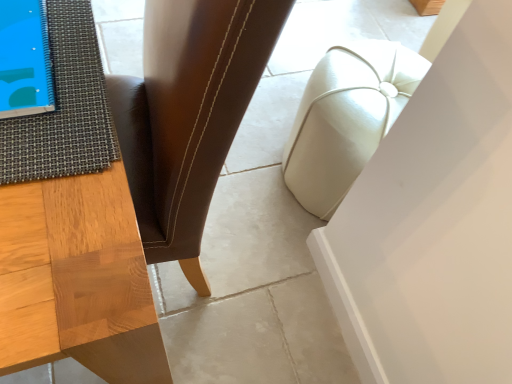
Question: Should I look upward or downward to see textured gray mat at left?

Choices:
 (A) up
 (B) down

Answer: (A)

Question: Is textured gray mat at left looking in the opposite direction of white leather ottoman at center?

Choices:
 (A) yes
 (B) no

Answer: (B)

Question: From a real-world perspective, does textured gray mat at left stand above white leather ottoman at center?

Choices:
 (A) yes
 (B) no

Answer: (A)

Question: Considering the relative sizes of textured gray mat at left and white leather ottoman at center in the image provided, is textured gray mat at left shorter than white leather ottoman at center?

Choices:
 (A) no
 (B) yes

Answer: (B)

Question: Can you confirm if textured gray mat at left is smaller than white leather ottoman at center?

Choices:
 (A) yes
 (B) no

Answer: (A)

Question: Is textured gray mat at left beside white leather ottoman at center?

Choices:
 (A) no
 (B) yes

Answer: (A)

Question: Would you say white leather ottoman at center is part of textured gray mat at left's contents?

Choices:
 (A) yes
 (B) no

Answer: (B)

Question: Is white leather ottoman at center bigger than textured gray mat at left?

Choices:
 (A) yes
 (B) no

Answer: (A)

Question: Is white leather ottoman at center thinner than textured gray mat at left?

Choices:
 (A) yes
 (B) no

Answer: (A)

Question: Does white leather ottoman at center have a greater width compared to textured gray mat at left?

Choices:
 (A) no
 (B) yes

Answer: (A)

Question: Could you tell me if white leather ottoman at center is facing textured gray mat at left?

Choices:
 (A) yes
 (B) no

Answer: (B)

Question: Is white leather ottoman at center positioned with its back to textured gray mat at left?

Choices:
 (A) yes
 (B) no

Answer: (B)

Question: Is white leather ottoman at center in contact with textured gray mat at left?

Choices:
 (A) yes
 (B) no

Answer: (B)

Question: Can you confirm if brown leather chair at center is taller than textured gray mat at left?

Choices:
 (A) yes
 (B) no

Answer: (A)